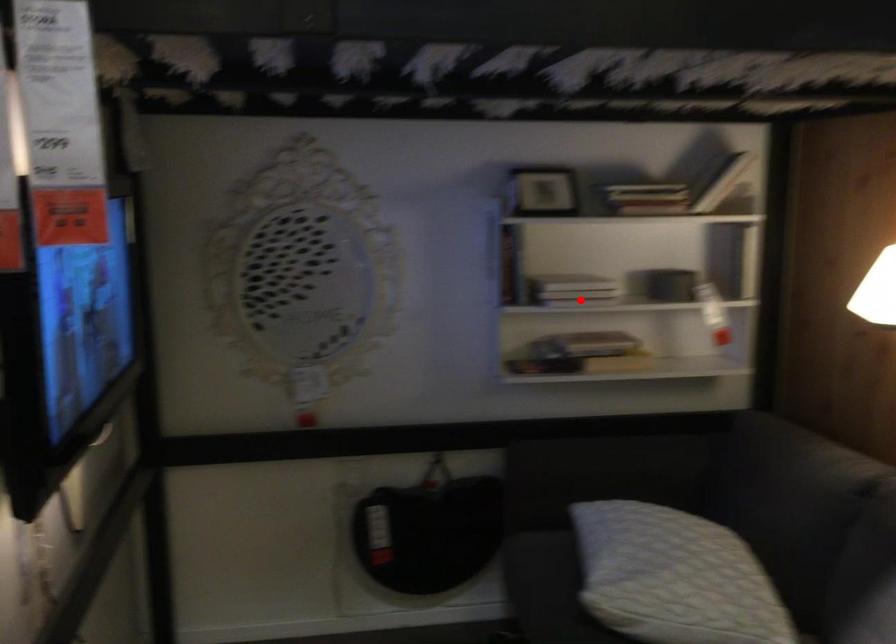
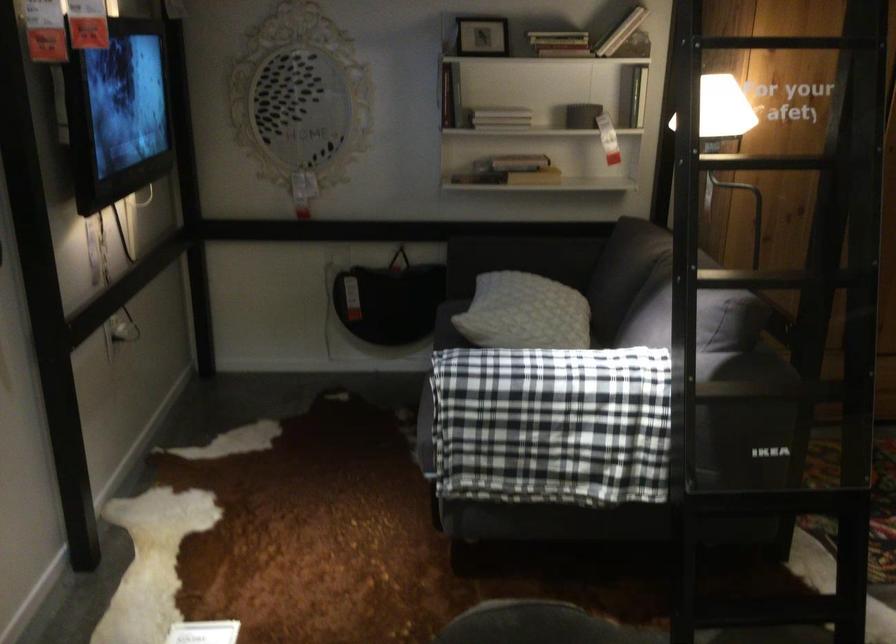
Find the pixel in the second image that matches the highlighted location in the first image.

(500, 118)